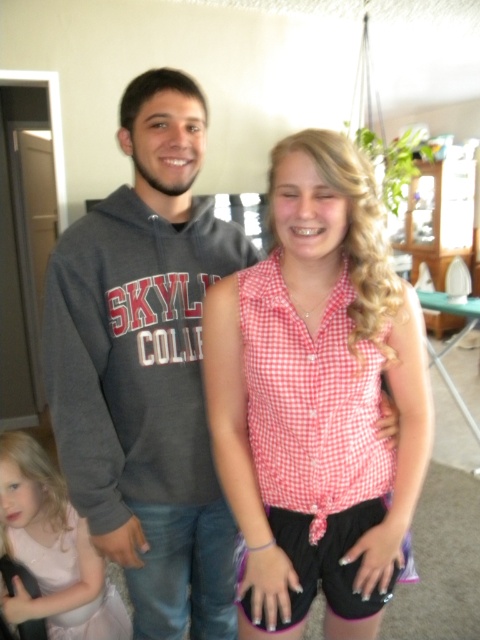
Which of these two, pink checkered shirt at center or pink satin dress at lower left, stands taller?

With more height is pink checkered shirt at center.

Who is positioned more to the left, pink checkered shirt at center or pink satin dress at lower left?

Positioned to the left is pink satin dress at lower left.

Where is `pink checkered shirt at center`? This screenshot has height=640, width=480. pink checkered shirt at center is located at coordinates (316, 397).

This screenshot has width=480, height=640. What are the coordinates of `pink checkered shirt at center` in the screenshot? It's located at (316, 397).

Between dark gray hoodie at center and pink satin dress at lower left, which one is positioned higher?

Positioned higher is dark gray hoodie at center.

Can you confirm if dark gray hoodie at center is positioned below pink satin dress at lower left?

Actually, dark gray hoodie at center is above pink satin dress at lower left.

Which is behind, point (170, 586) or point (67, 605)?

The point (67, 605) is more distant.

The image size is (480, 640). Find the location of `dark gray hoodie at center`. dark gray hoodie at center is located at coordinates (145, 368).

Does pink checkered shirt at center lie in front of dark gray hoodie at center?

Yes, it is in front of dark gray hoodie at center.

Which is below, pink checkered shirt at center or dark gray hoodie at center?

dark gray hoodie at center is below.

What are the coordinates of `pink checkered shirt at center` in the screenshot? It's located at (316, 397).

Locate an element on the screen. pink checkered shirt at center is located at coordinates (316, 397).